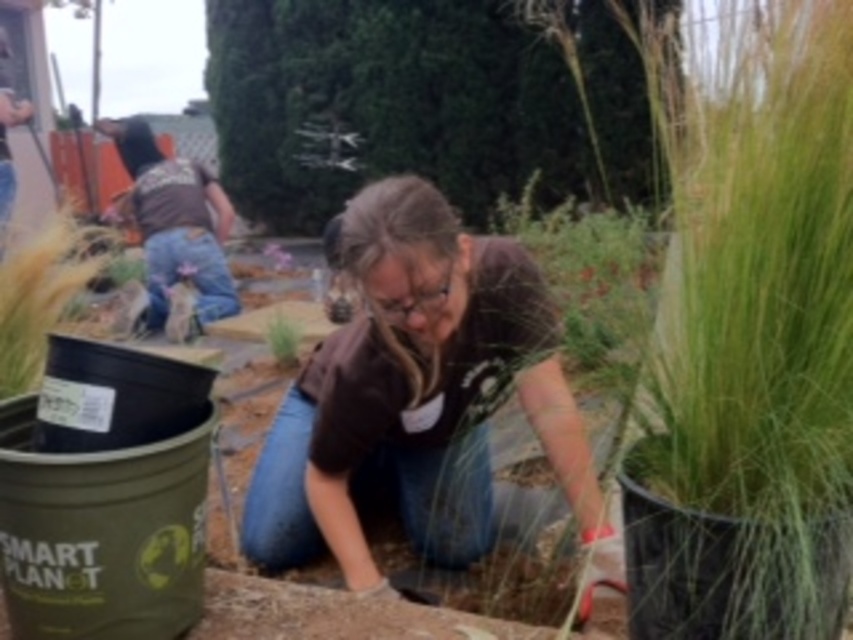
Question: Does brown cotton shirt at center have a lesser width compared to green matte plant at center?

Choices:
 (A) yes
 (B) no

Answer: (B)

Question: Is brown cotton shirt at center bigger than green matte plant at center?

Choices:
 (A) no
 (B) yes

Answer: (B)

Question: Does brown cotton shirt at center come in front of green matte plant at center?

Choices:
 (A) no
 (B) yes

Answer: (B)

Question: Among these points, which one is farthest from the camera?

Choices:
 (A) (274, 353)
 (B) (550, 371)

Answer: (A)